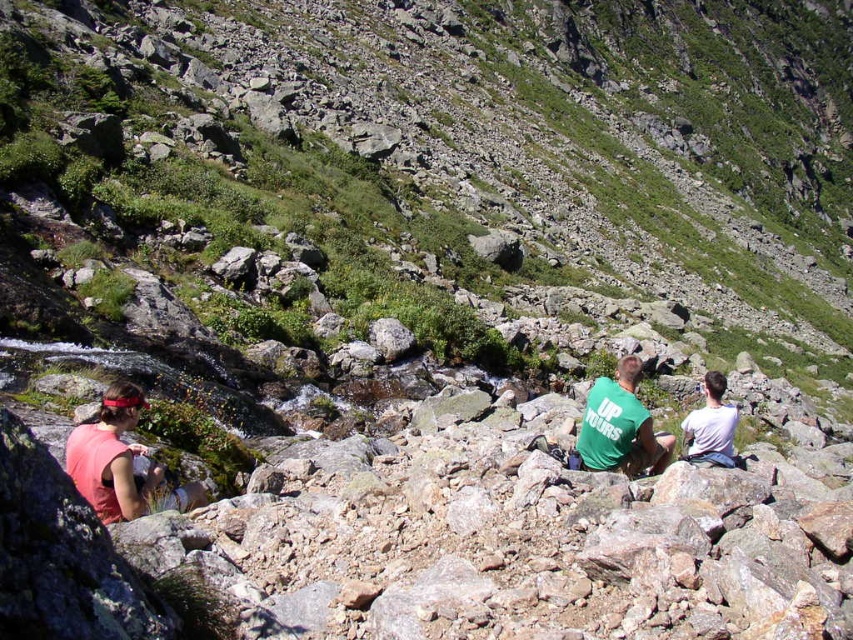
Question: Is green t-shirt at center to the right of white cotton shirt at right from the viewer's perspective?

Choices:
 (A) no
 (B) yes

Answer: (A)

Question: Which point is closer to the camera?

Choices:
 (A) green t-shirt at center
 (B) white cotton shirt at right

Answer: (B)

Question: Can you confirm if green t-shirt at center is wider than white cotton shirt at right?

Choices:
 (A) yes
 (B) no

Answer: (B)

Question: Is green t-shirt at center above white cotton shirt at right?

Choices:
 (A) no
 (B) yes

Answer: (B)

Question: Which of the following is the farthest from the observer?

Choices:
 (A) green t-shirt at center
 (B) white cotton shirt at right

Answer: (A)